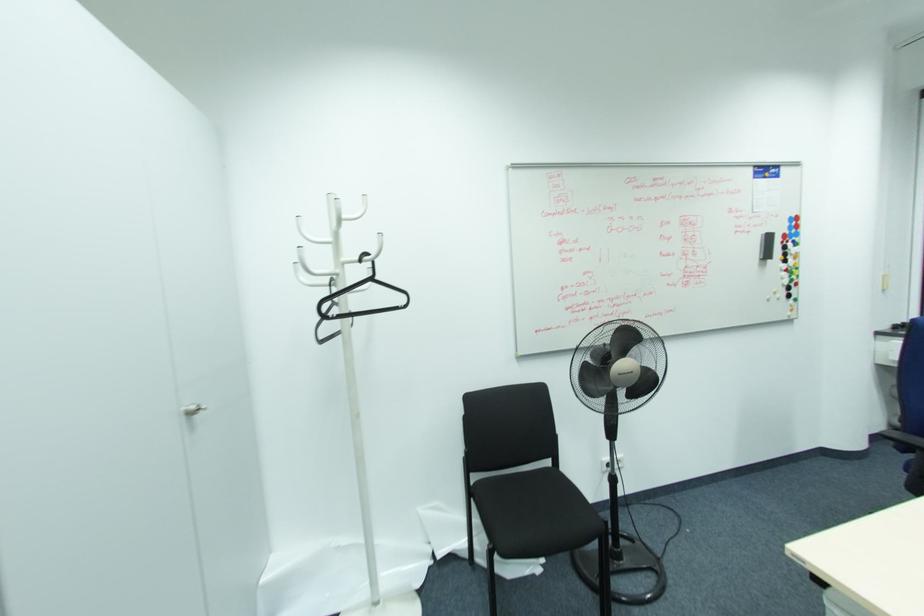
The location [791,264] corresponds to which object?

This point indicates the colorful round magnet.